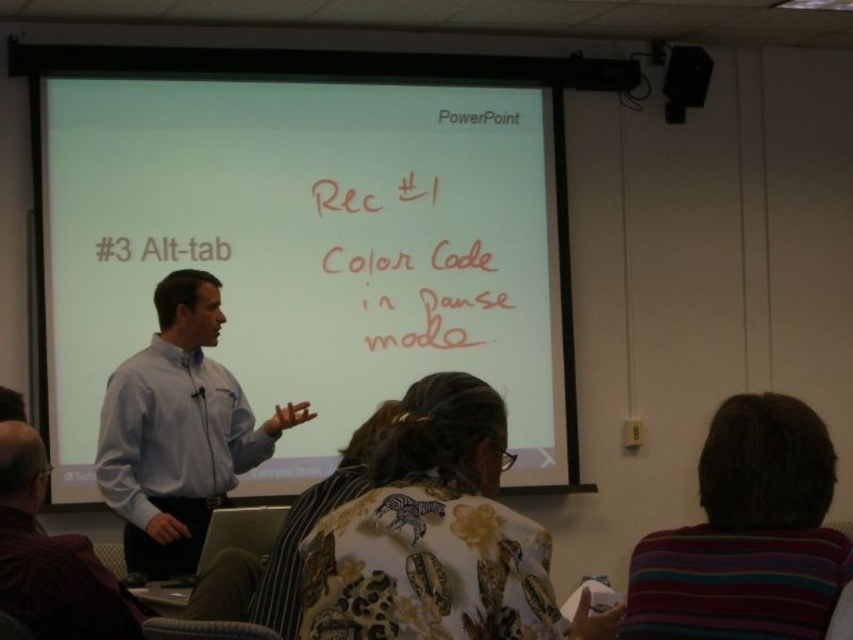
You are an attendee at this presentation and want to take a photo of the white matte projector screen at upper center and the floral fabric shirt at center. Which object will appear wider in your photo?

The white matte projector screen at upper center will appear wider in your photo because its width is larger than the floral fabric shirt at center.

As a presenter standing 3 feet away from the white matte projector screen at upper center, can you clearly see the slide content displayed on the screen?

The white matte projector screen at upper center is 12.69 feet away from the viewer. Since you are standing 3 feet away from the screen, your total distance from the viewer is 15.69 feet. However, the clarity of the slide content depends on factors like screen size, resolution, and lighting, which are not specified in the scene description. Therefore, it cannot be determined if you can clearly see the content based on the given information.

You are sitting in the back row of the classroom and want to see the presenter clearly. Which shirt should you look at to see the presenter better, the light blue shirt at center or the matte blue shirt at center?

The light blue shirt at center is in front of the matte blue shirt at center, so looking at the light blue shirt at center would allow you to see the presenter better as it is closer to the front.